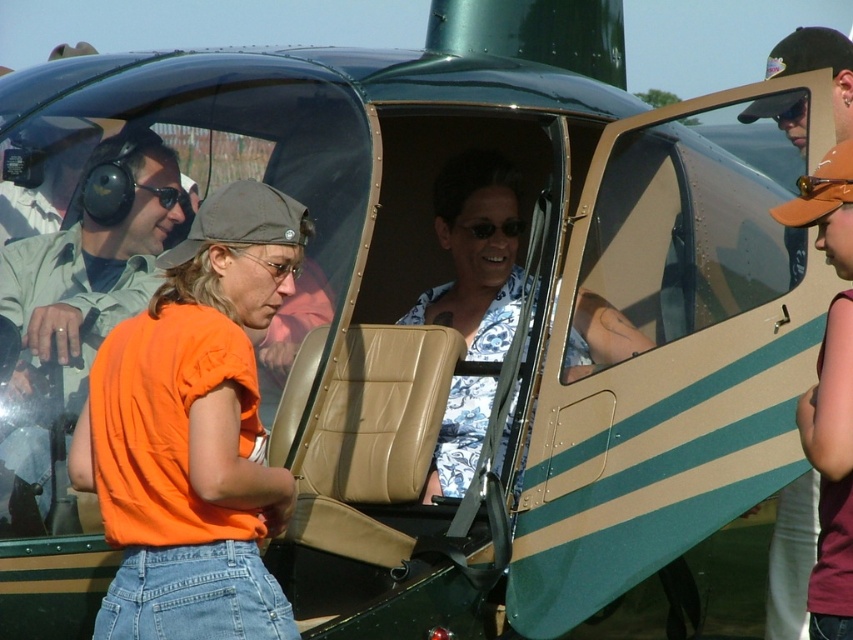
Question: Can you confirm if matte black helmet at left is wider than floral shirt at center?

Choices:
 (A) no
 (B) yes

Answer: (A)

Question: Does floral shirt at center have a smaller size compared to orange t-shirt at center?

Choices:
 (A) no
 (B) yes

Answer: (A)

Question: Can you confirm if orange cotton shirt at center is thinner than orange t-shirt at center?

Choices:
 (A) no
 (B) yes

Answer: (A)

Question: Among these objects, which one is farthest from the camera?

Choices:
 (A) orange t-shirt at center
 (B) black plastic sunglasses at upper center
 (C) black rubber goggles at upper center

Answer: (C)

Question: Which point appears closest to the camera in this image?

Choices:
 (A) (67, 360)
 (B) (820, 241)

Answer: (A)

Question: Estimate the real-world distances between objects in this image. Which object is farther from the floral shirt at center?

Choices:
 (A) black rubber goggles at upper center
 (B) matte black goggles at center
 (C) matte black helmet at left
 (D) black plastic sunglasses at upper center

Answer: (C)